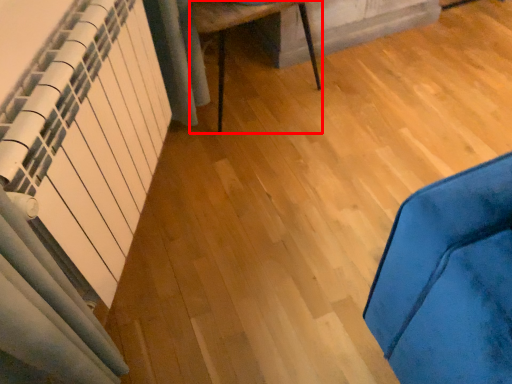
Question: From the image's perspective, what is the correct spatial relationship of furniture (annotated by the red box) in relation to radiator?

Choices:
 (A) above
 (B) below

Answer: (A)